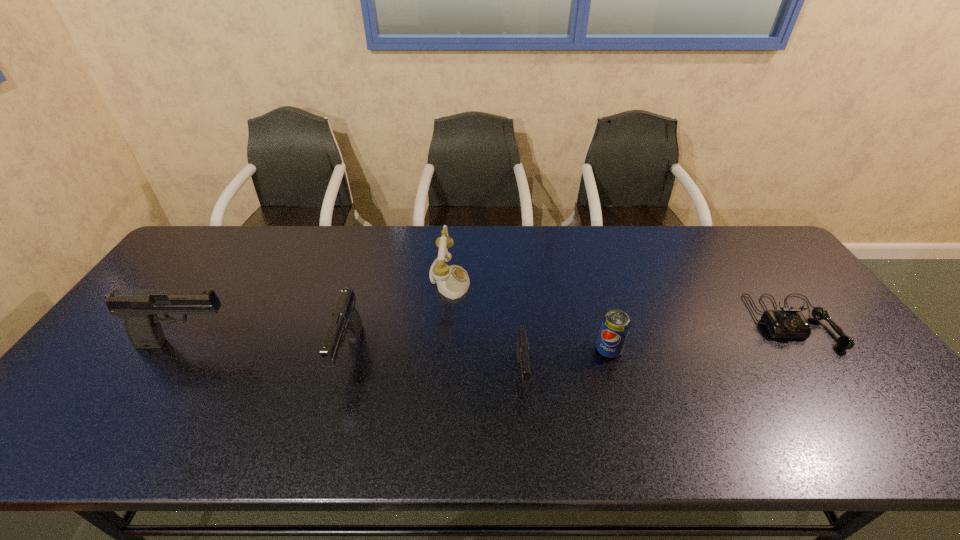
Identify which object is located as the fifth nearest to the right telephone. Please provide its 2D coordinates. Your answer should be formatted as a tuple, i.e. [(x, y)], where the tuple contains the x and y coordinates of a point satisfying the conditions above.

[(138, 307)]

The image size is (960, 540). I want to click on object identified as the fifth closest to the second object from right to left, so click(138, 307).

Identify the location of the closest pistol to the second object from left to right. (x=138, y=307).

At what (x,y) coordinates should I click in order to perform the action: click on the closest pistol to the third object from right to left. Please return your answer as a coordinate pair (x, y). The width and height of the screenshot is (960, 540). Looking at the image, I should click on (346, 322).

Locate an element on the screen. The image size is (960, 540). vacant position in the image that satisfies the following two spatial constraints: 1. on the back side of the soda; 2. on the dial of the left telephone is located at coordinates (589, 281).

What are the coordinates of `vacant position in the image that satisfies the following two spatial constraints: 1. aim along the barrel of the second object from right to left; 2. on the right side of the leftmost pistol` in the screenshot? It's located at (183, 350).

This screenshot has width=960, height=540. Find the location of `free spot that satisfies the following two spatial constraints: 1. on the dial of the taller telephone; 2. on the back side of the fifth object from left to right`. free spot that satisfies the following two spatial constraints: 1. on the dial of the taller telephone; 2. on the back side of the fifth object from left to right is located at coordinates coord(444,350).

Locate an element on the screen. Image resolution: width=960 pixels, height=540 pixels. vacant area that satisfies the following two spatial constraints: 1. on the back side of the soda; 2. aim along the barrel of the leftmost object is located at coordinates (607, 343).

The width and height of the screenshot is (960, 540). I want to click on vacant region that satisfies the following two spatial constraints: 1. on the dial of the shorter telephone; 2. aim along the barrel of the leftmost object, so click(807, 343).

Image resolution: width=960 pixels, height=540 pixels. Find the location of `vacant space that satisfies the following two spatial constraints: 1. on the dial of the fourth object from right to left; 2. on the back side of the soda`. vacant space that satisfies the following two spatial constraints: 1. on the dial of the fourth object from right to left; 2. on the back side of the soda is located at coordinates (444, 350).